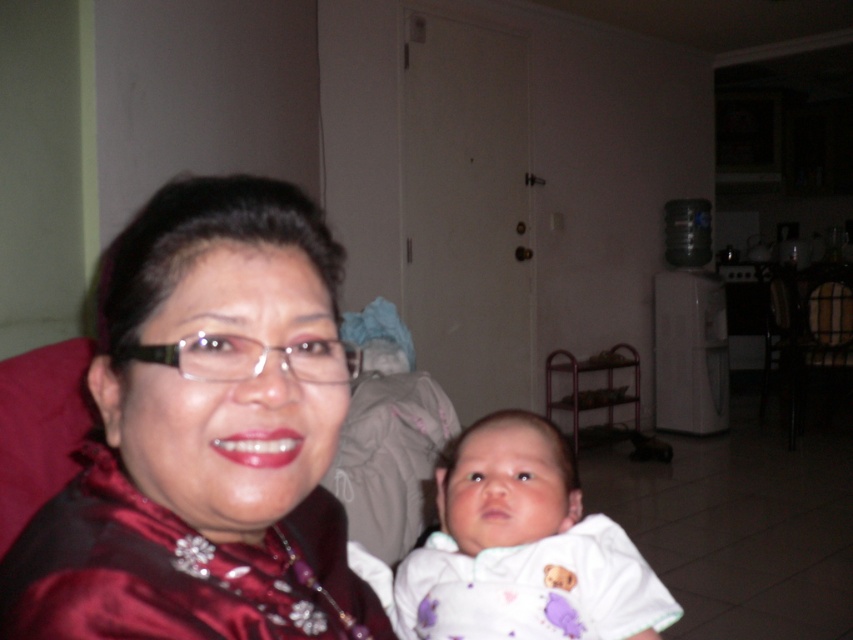
Question: Among these points, which one is nearest to the camera?

Choices:
 (A) (129, 355)
 (B) (604, 570)

Answer: (A)

Question: Which point appears closest to the camera in this image?

Choices:
 (A) (622, 612)
 (B) (347, 380)

Answer: (B)

Question: Does satin red blouse at left have a lesser width compared to white soft fabric baby at center?

Choices:
 (A) no
 (B) yes

Answer: (B)

Question: Is satin red blouse at left smaller than white soft fabric baby at center?

Choices:
 (A) yes
 (B) no

Answer: (B)

Question: Is satin red blouse at left smaller than white soft fabric baby at center?

Choices:
 (A) yes
 (B) no

Answer: (B)

Question: Which of the following is the closest to the observer?

Choices:
 (A) click(x=322, y=266)
 (B) click(x=428, y=554)

Answer: (A)